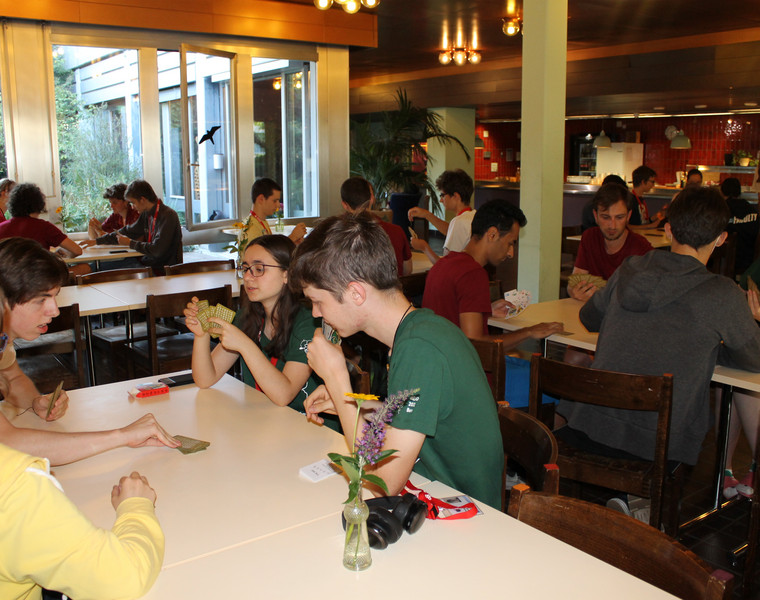
Find the location of a particular element. The height and width of the screenshot is (600, 760). posts in room is located at coordinates (451, 116), (536, 113).